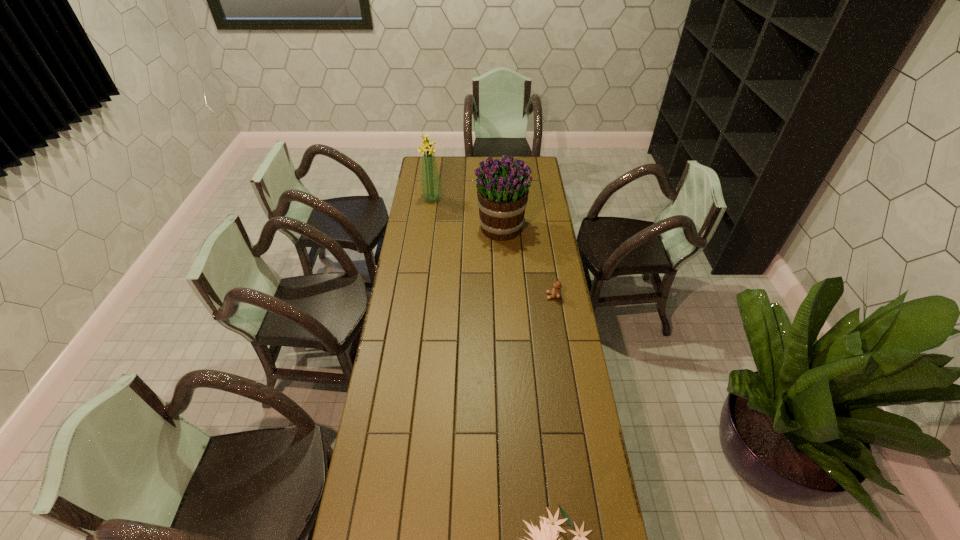
The width and height of the screenshot is (960, 540). Identify the location of object located at the left edge. (431, 191).

Identify the location of bouquet present at the right edge. (502, 190).

The height and width of the screenshot is (540, 960). I want to click on teddy bear situated at the right edge, so coord(556,292).

What are the coordinates of `free space at the far edge of the desktop` in the screenshot? It's located at (448, 164).

Locate an element on the screen. free space at the left edge of the desktop is located at coordinates (404, 454).

Where is `blank space at the right edge`? blank space at the right edge is located at coordinates (550, 367).

Image resolution: width=960 pixels, height=540 pixels. I want to click on free space at the far right corner of the desktop, so click(540, 165).

At what (x,y) coordinates should I click in order to perform the action: click on free spot between the second nearest object and the farthest bouquet. Please return your answer as a coordinate pair (x, y). Looking at the image, I should click on (492, 247).

Identify the location of vacant area that lies between the farthest bouquet and the third farthest object. click(492, 247).

Find the location of `vacant space that is in between the second nearest bouquet and the shortest object`. vacant space that is in between the second nearest bouquet and the shortest object is located at coordinates (527, 262).